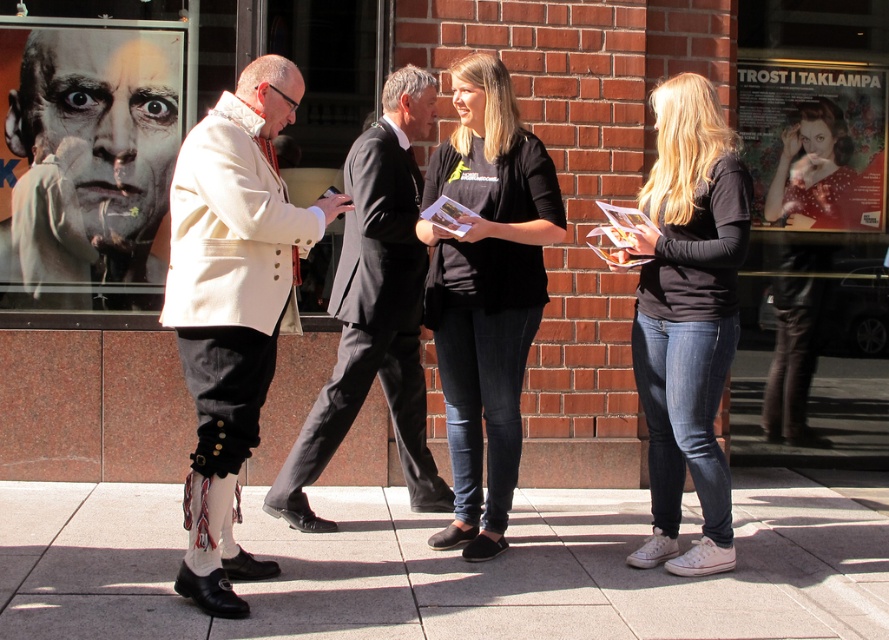
Is concrete paving at lower center closer to camera compared to black cotton shirt at center?

Yes, it is.

Does concrete paving at lower center appear over black cotton shirt at center?

Actually, concrete paving at lower center is below black cotton shirt at center.

This screenshot has width=889, height=640. Describe the element at coordinates (443, 566) in the screenshot. I see `concrete paving at lower center` at that location.

Where is `concrete paving at lower center`? Image resolution: width=889 pixels, height=640 pixels. concrete paving at lower center is located at coordinates (x=443, y=566).

Is white leather coat at center above matte black coat at center?

No, white leather coat at center is not above matte black coat at center.

Who is more distant from viewer, (251, 129) or (135, 241)?

The point (135, 241) is behind.

Who is more forward, (199, 333) or (42, 77)?

Positioned in front is point (199, 333).

In order to click on white leather coat at center in this screenshot , I will do `click(231, 305)`.

Is point (347, 534) positioned behind point (487, 484)?

Yes, it is behind point (487, 484).

Is concrete paving at lower center shorter than black cotton t-shirt at center?

Yes.

Who is more distant from viewer, [180,544] or [439,301]?

The point [180,544] is behind.

This screenshot has height=640, width=889. Identify the location of concrete paving at lower center. (443, 566).